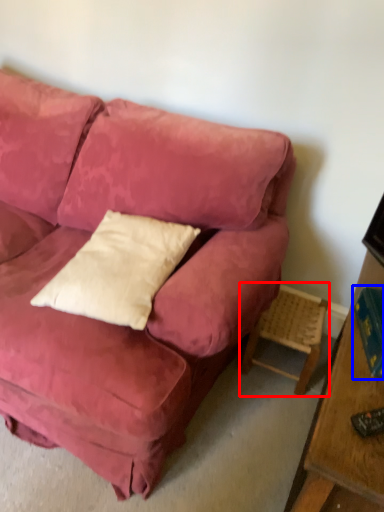
Question: Which object appears closest to the camera in this image, side table (highlighted by a red box) or book (highlighted by a blue box)?

Choices:
 (A) side table
 (B) book

Answer: (B)